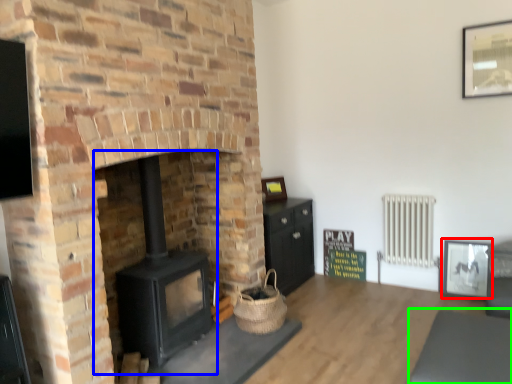
Question: Which is farther away from picture frame (highlighted by a red box)? wood burning stove (highlighted by a blue box) or gray (highlighted by a green box)?

Choices:
 (A) wood burning stove
 (B) gray

Answer: (A)